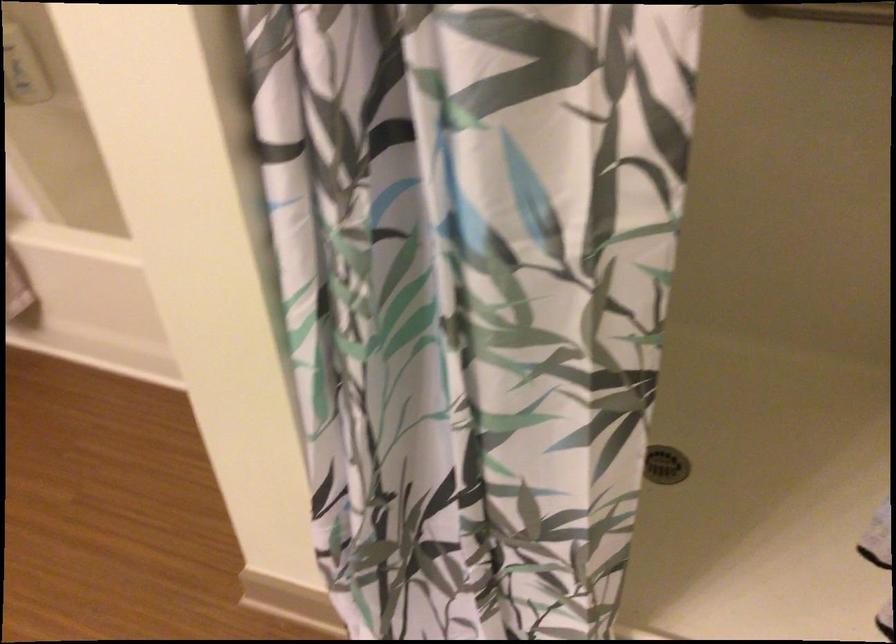
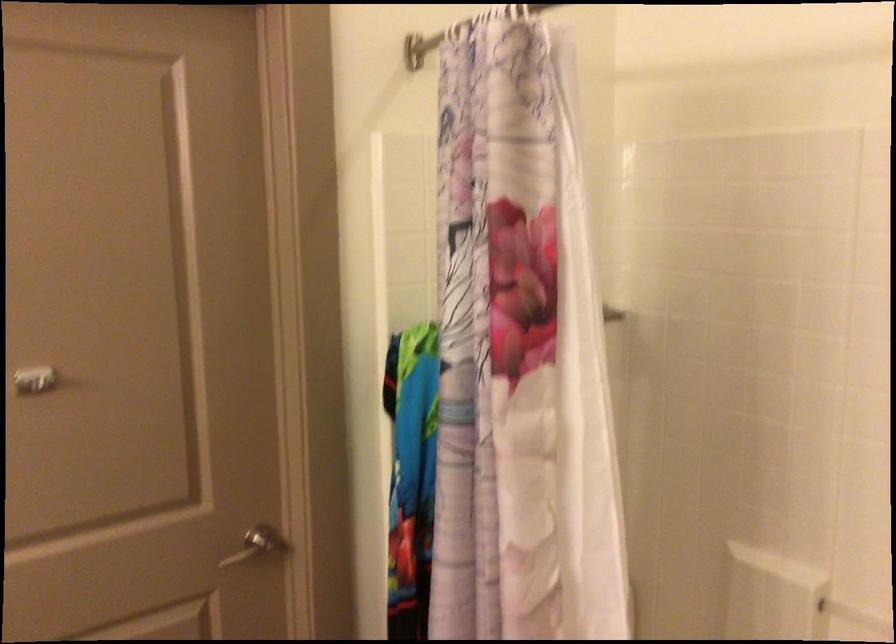
How did the camera likely rotate?

The camera rotated toward left-up.